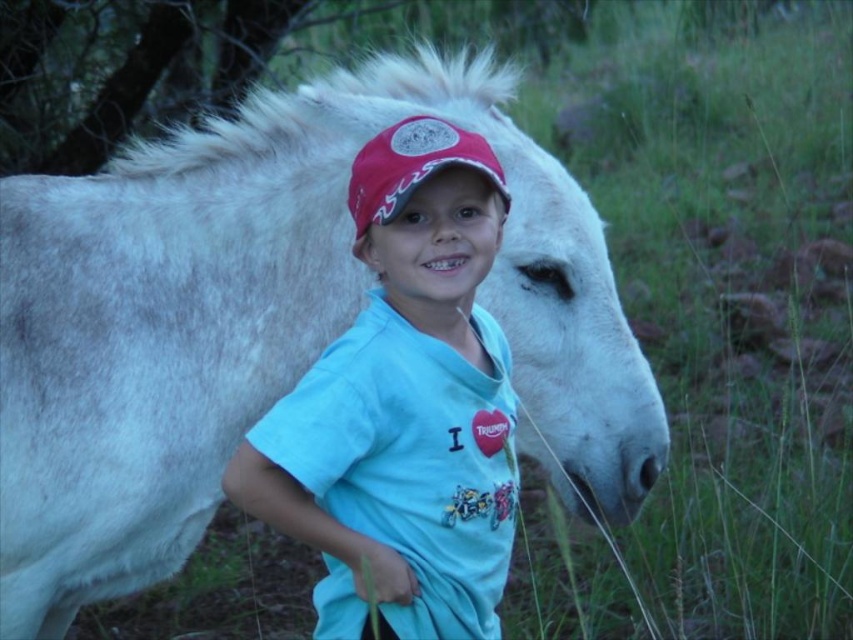
Can you confirm if white matte horse at center is taller than matte red cap at center?

Indeed, white matte horse at center has a greater height compared to matte red cap at center.

Identify the location of white matte horse at center. This screenshot has height=640, width=853. (263, 323).

This screenshot has height=640, width=853. What do you see at coordinates (263, 323) in the screenshot? I see `white matte horse at center` at bounding box center [263, 323].

I want to click on white matte horse at center, so click(x=263, y=323).